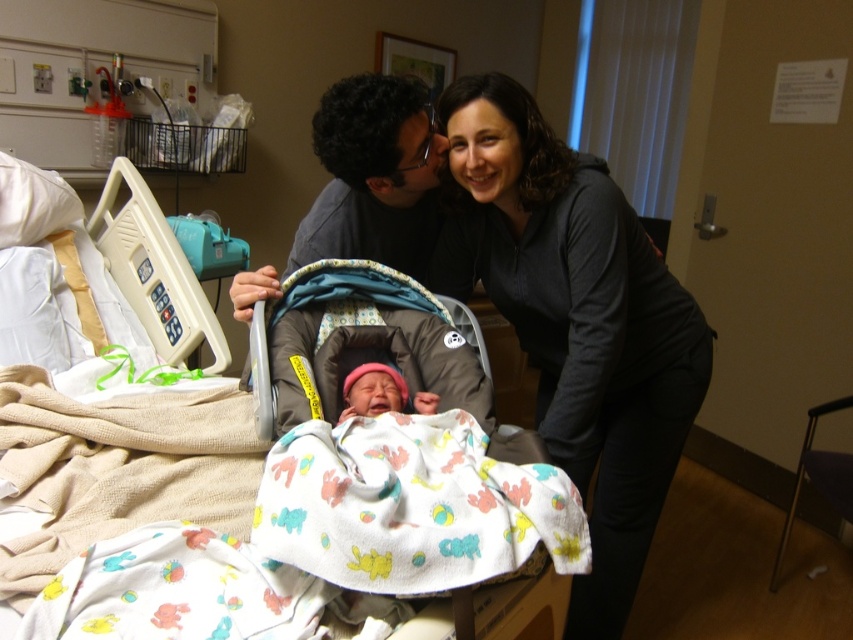
Does dark gray sweater at center appear over brown fabric baby carriage at center?

Indeed, dark gray sweater at center is positioned over brown fabric baby carriage at center.

Does point (633, 548) come closer to viewer compared to point (283, 420)?

No.

Identify the location of dark gray sweater at center. (575, 321).

Does soft fabric infant bed at center have a larger size compared to dark gray sweater at center?

Correct, soft fabric infant bed at center is larger in size than dark gray sweater at center.

Who is more forward, (358, 579) or (627, 301)?

Point (358, 579) is more forward.

The width and height of the screenshot is (853, 640). What do you see at coordinates (268, 497) in the screenshot?
I see `soft fabric infant bed at center` at bounding box center [268, 497].

The height and width of the screenshot is (640, 853). Find the location of `soft fabric infant bed at center`. soft fabric infant bed at center is located at coordinates (268, 497).

Where is `dark gray sweater at center`? dark gray sweater at center is located at coordinates (575, 321).

In the scene shown: Does dark gray sweater at center have a lesser height compared to matte gray stroller at center?

No.

Is point (508, 93) more distant than point (375, 209)?

No.

Locate an element on the screen. This screenshot has width=853, height=640. dark gray sweater at center is located at coordinates (575, 321).